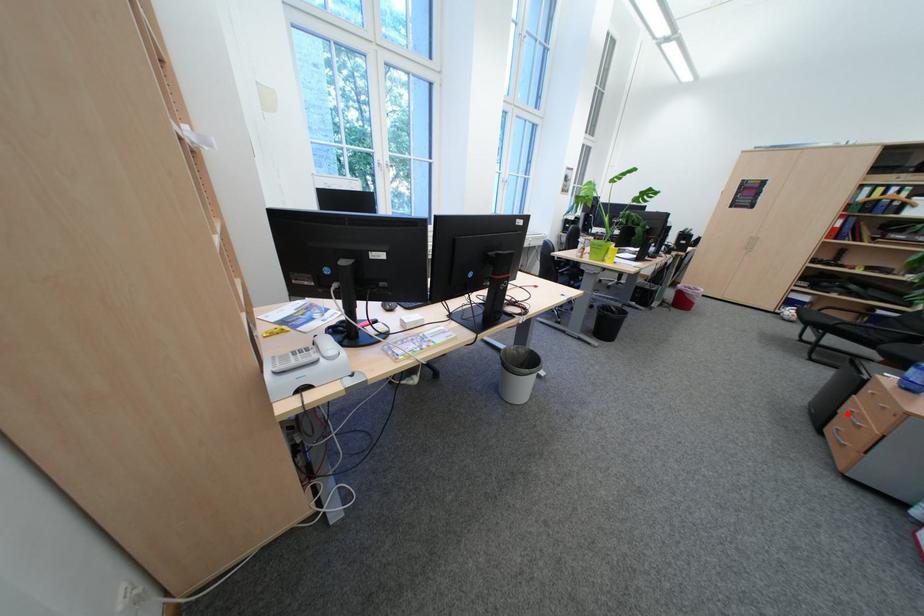
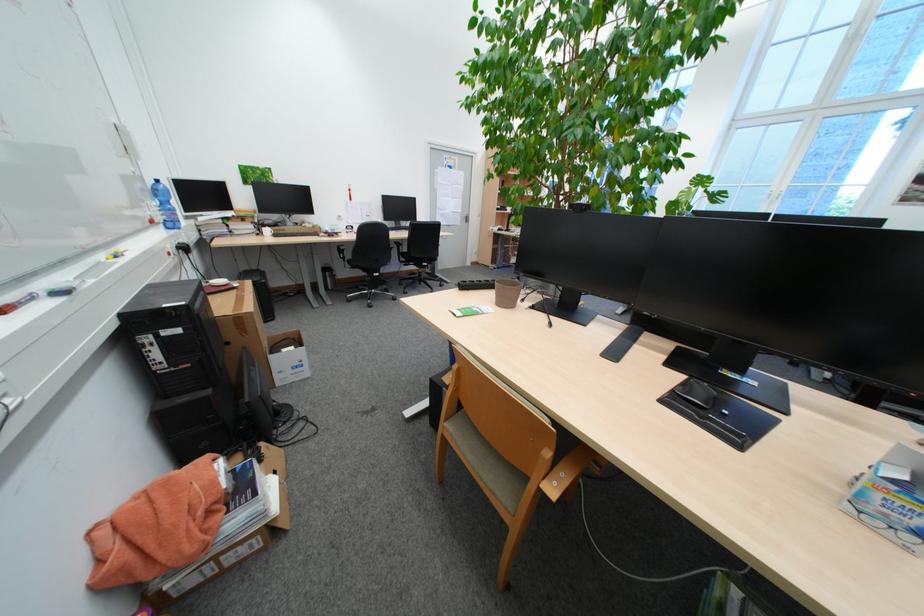
Question: I am providing you with two images of the same scene from different viewpoints. A red point is marked on the first image. Is the red point's position out of view in image 2?

Choices:
 (A) Yes
 (B) No

Answer: (A)